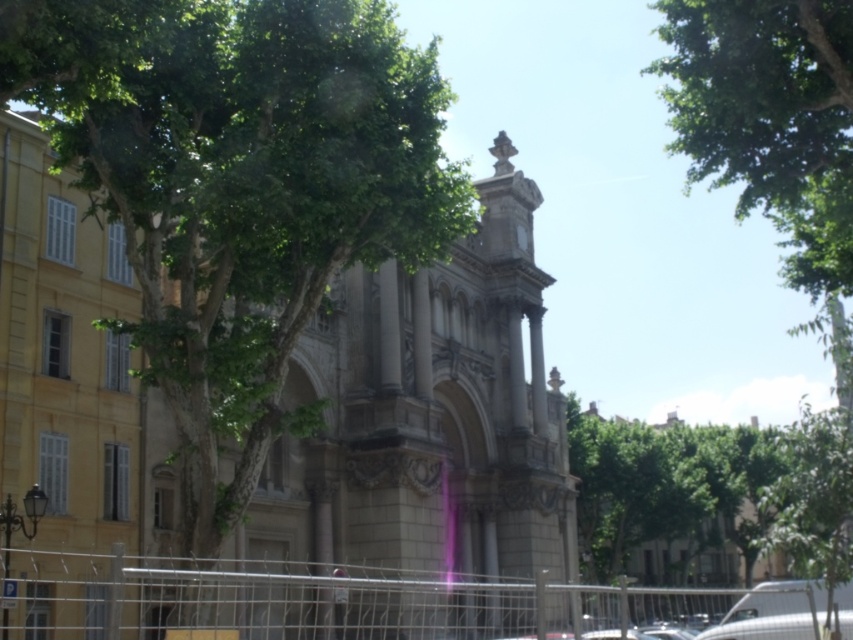
Question: Observing the image, what is the correct spatial positioning of green leafy tree at center in reference to green leafy tree at upper right?

Choices:
 (A) above
 (B) below

Answer: (B)

Question: Is metallic wire fence at lower center wider than green leafy tree at upper right?

Choices:
 (A) no
 (B) yes

Answer: (B)

Question: Which point is closer to the camera taking this photo?

Choices:
 (A) (410, 180)
 (B) (564, 612)
 (C) (688, 4)

Answer: (A)

Question: Which of the following is the farthest from the observer?

Choices:
 (A) (223, 580)
 (B) (769, 186)

Answer: (B)

Question: Which point is farther to the camera?

Choices:
 (A) (833, 156)
 (B) (711, 605)
 (C) (234, 305)

Answer: (B)

Question: Is green leafy tree at center positioned in front of metallic wire fence at lower center?

Choices:
 (A) yes
 (B) no

Answer: (B)